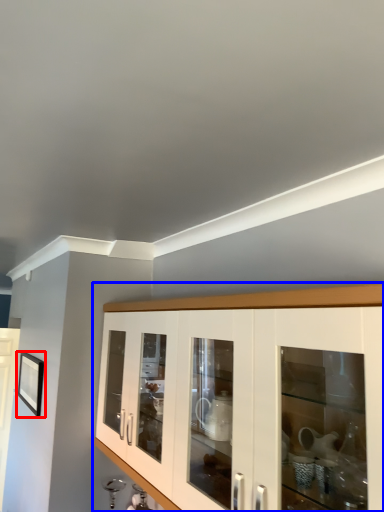
Question: Which point is closer to the camera, picture frame (highlighted by a red box) or cabinetry (highlighted by a blue box)?

Choices:
 (A) picture frame
 (B) cabinetry

Answer: (B)